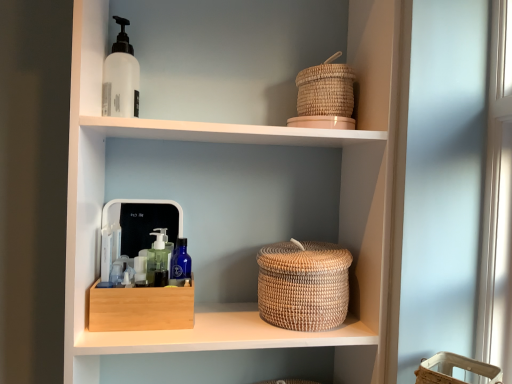
The image size is (512, 384). Identify the location of woven natural basket at center. (303, 285).

Describe the element at coordinates (231, 178) in the screenshot. I see `natural woven basket at upper right` at that location.

This screenshot has width=512, height=384. What are the coordinates of `white matte bottle at upper left` in the screenshot? It's located at (121, 77).

What do you see at coordinates (141, 308) in the screenshot?
I see `bamboo box at center` at bounding box center [141, 308].

At what (x,y) coordinates should I click in order to perform the action: click on woven natural basket at center. Please return your answer as a coordinate pair (x, y). Looking at the image, I should click on click(303, 285).

Is white matte bottle at upper left oriented towards natural woven basket at upper right?

Yes, white matte bottle at upper left is oriented towards natural woven basket at upper right.

Is white matte bottle at upper left bigger or smaller than natural woven basket at upper right?

white matte bottle at upper left is smaller than natural woven basket at upper right.

Is white matte bottle at upper left next to natural woven basket at upper right and touching it?

white matte bottle at upper left and natural woven basket at upper right are not in contact.

Measure the distance between white matte bottle at upper left and natural woven basket at upper right.

white matte bottle at upper left is 15.75 inches away from natural woven basket at upper right.

Can you tell me how much woven beige basket at lower right, positioned as the 1th basket in bottom-to-top order, and woven natural basket at center differ in facing direction?

There is a 57.2-degree angle between the facing directions of woven beige basket at lower right, positioned as the 1th basket in bottom-to-top order, and woven natural basket at center.

Which is more to the right, woven beige basket at lower right, the 2th basket positioned from the left, or woven natural basket at center?

Positioned to the right is woven beige basket at lower right, the 2th basket positioned from the left.

In terms of size, does woven beige basket at lower right, which is the first basket in right-to-left order, appear bigger or smaller than woven natural basket at center?

woven beige basket at lower right, which is the first basket in right-to-left order, is smaller than woven natural basket at center.

This screenshot has height=384, width=512. In order to click on basket container above the woven beige basket at lower right, which is the first basket in right-to-left order (from the image's perspective) in this screenshot , I will do `click(303, 285)`.

From the picture: From a real-world perspective, is woven beige basket at lower right, which is the first basket in right-to-left order, on bamboo box at center?

Actually, woven beige basket at lower right, which is the first basket in right-to-left order, is physically below bamboo box at center in the real world.

Can you confirm if woven beige basket at lower right, the 2th basket positioned from the left, is positioned to the left of bamboo box at center?

Incorrect, woven beige basket at lower right, the 2th basket positioned from the left, is not on the left side of bamboo box at center.

In the scene shown: Are woven beige basket at lower right, the 2th basket when ordered from top to bottom, and bamboo box at center beside each other?

No, woven beige basket at lower right, the 2th basket when ordered from top to bottom, is not making contact with bamboo box at center.

From the image's perspective, which object appears higher, woven beige basket at lower right, the 2th basket positioned from the left, or bamboo box at center?

bamboo box at center appears higher in the image.

Between woven natural basket at center and natural woven basket at upper right, which one appears on the left side from the viewer's perspective?

Positioned to the left is natural woven basket at upper right.

Considering the relative sizes of woven natural basket at center and natural woven basket at upper right in the image provided, is woven natural basket at center smaller than natural woven basket at upper right?

Indeed, woven natural basket at center has a smaller size compared to natural woven basket at upper right.

Considering the sizes of woven natural basket at center and natural woven basket at upper right in the image, is woven natural basket at center wider or thinner than natural woven basket at upper right?

Considering their sizes, woven natural basket at center looks slimmer than natural woven basket at upper right.

From the image's perspective, between woven natural basket at center and natural woven basket at upper right, who is located below?

woven natural basket at center appears lower in the image.

Identify the location of shelf that is in front of the bamboo box at center. The height and width of the screenshot is (384, 512). click(x=231, y=178).

Is natural woven basket at upper right touching bamboo box at center?

There is a gap between natural woven basket at upper right and bamboo box at center.

Does natural woven basket at upper right turn towards bamboo box at center?

Yes, natural woven basket at upper right is aimed at bamboo box at center.

Is natural woven basket at upper right completely or partially outside of bamboo box at center?

Indeed, natural woven basket at upper right is completely outside bamboo box at center.

From a real-world perspective, is woven beige basket at lower right, the 2th basket positioned from the left, positioned over woven natural basket at upper right, the 1th basket when ordered from back to front, based on gravity?

No, from a real-world perspective, woven beige basket at lower right, the 2th basket positioned from the left, is not over woven natural basket at upper right, the 1th basket when ordered from back to front

How many degrees apart are the facing directions of woven beige basket at lower right, the 2th basket positioned from the left, and woven natural basket at upper right, acting as the 2th basket starting from the right?

The facing directions of woven beige basket at lower right, the 2th basket positioned from the left, and woven natural basket at upper right, acting as the 2th basket starting from the right, are 58.9 degrees apart.

Who is taller, woven beige basket at lower right, which is the first basket in right-to-left order, or woven natural basket at upper right, acting as the 2th basket starting from the right?

With more height is woven beige basket at lower right, which is the first basket in right-to-left order.

Is bamboo box at center to the right of woven natural basket at center from the viewer's perspective?

In fact, bamboo box at center is to the left of woven natural basket at center.

Looking at this image, from a real-world perspective, is bamboo box at center above or below woven natural basket at center?

From a real-world perspective, bamboo box at center is physically below woven natural basket at center.

Looking at this image, measure the distance between bamboo box at center and woven natural basket at center.

27.83 centimeters.

Is bamboo box at center wider than woven natural basket at center?

Incorrect, the width of bamboo box at center does not surpass that of woven natural basket at center.

I want to click on mouthwash on the left of the natural woven basket at upper right, so click(121, 77).

What are the coordinates of `basket container above the woven beige basket at lower right, the 2th basket when ordered from top to bottom (from a real-world perspective)` in the screenshot? It's located at (303, 285).

Based on their spatial positions, is natural woven basket at upper right or woven natural basket at center further from woven natural basket at upper right, placed as the 1th basket when sorted from top to bottom?

woven natural basket at center is positioned further to the anchor woven natural basket at upper right, placed as the 1th basket when sorted from top to bottom.

From the image, which object appears to be farther from natural woven basket at upper right, woven natural basket at center or woven beige basket at lower right, which is the first basket in right-to-left order?

Among the two, woven beige basket at lower right, which is the first basket in right-to-left order, is located further to natural woven basket at upper right.

Based on the photo, when comparing their distances from woven beige basket at lower right, which appears as the second basket when viewed from the back, does natural woven basket at upper right or woven natural basket at center seem closer?

Based on the image, woven natural basket at center appears to be nearer to woven beige basket at lower right, which appears as the second basket when viewed from the back.

Consider the image. Considering their positions, is bamboo box at center positioned closer to woven beige basket at lower right, which appears as the second basket when viewed from the back, than white matte bottle at upper left?

bamboo box at center.

Looking at the image, which one is located further to woven beige basket at lower right, which is the first basket in right-to-left order, woven natural basket at center or natural woven basket at upper right?

Among the two, natural woven basket at upper right is located further to woven beige basket at lower right, which is the first basket in right-to-left order.

Which object lies further to the anchor point woven beige basket at lower right, which appears as the second basket when viewed from the back, bamboo box at center or woven natural basket at center?

The object further to woven beige basket at lower right, which appears as the second basket when viewed from the back, is bamboo box at center.

Estimate the real-world distances between objects in this image. Which object is closer to natural woven basket at upper right, white matte bottle at upper left or woven natural basket at upper right, which ranks as the second basket in bottom-to-top order?

woven natural basket at upper right, which ranks as the second basket in bottom-to-top order, is closer to natural woven basket at upper right.

Estimate the real-world distances between objects in this image. Which object is further from natural woven basket at upper right, woven natural basket at upper right, placed as the 1th basket when sorted from top to bottom, or bamboo box at center?

bamboo box at center.

Locate an element on the screen. Image resolution: width=512 pixels, height=384 pixels. basket container that lies between white matte bottle at upper left and bamboo box at center from top to bottom is located at coordinates (303, 285).

Identify the location of basket container located between natural woven basket at upper right and woven beige basket at lower right, which appears as the first basket when viewed from the front, in the left-right direction. click(x=303, y=285).

I want to click on basket container between woven natural basket at upper right, which ranks as the second basket in bottom-to-top order, and bamboo box at center from top to bottom, so click(303, 285).

This screenshot has width=512, height=384. Identify the location of basket between white matte bottle at upper left and bamboo box at center in the up-down direction. (325, 90).